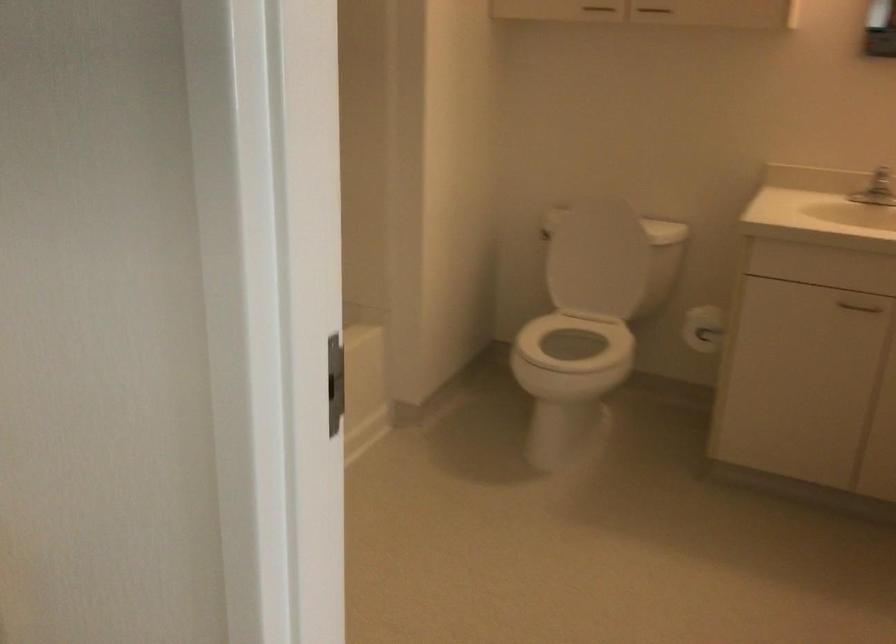
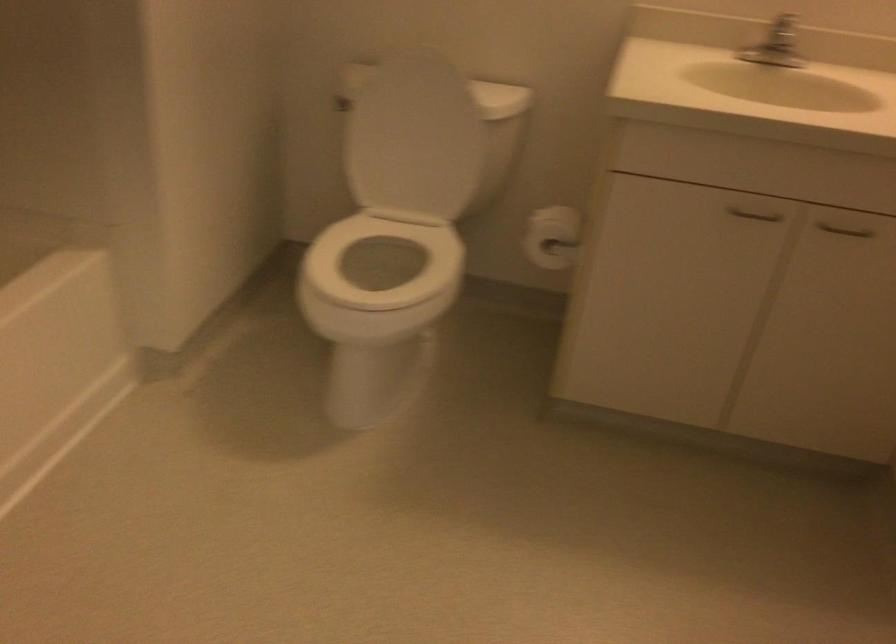
In the second image, find the point that corresponds to [538,238] in the first image.

(340, 104)